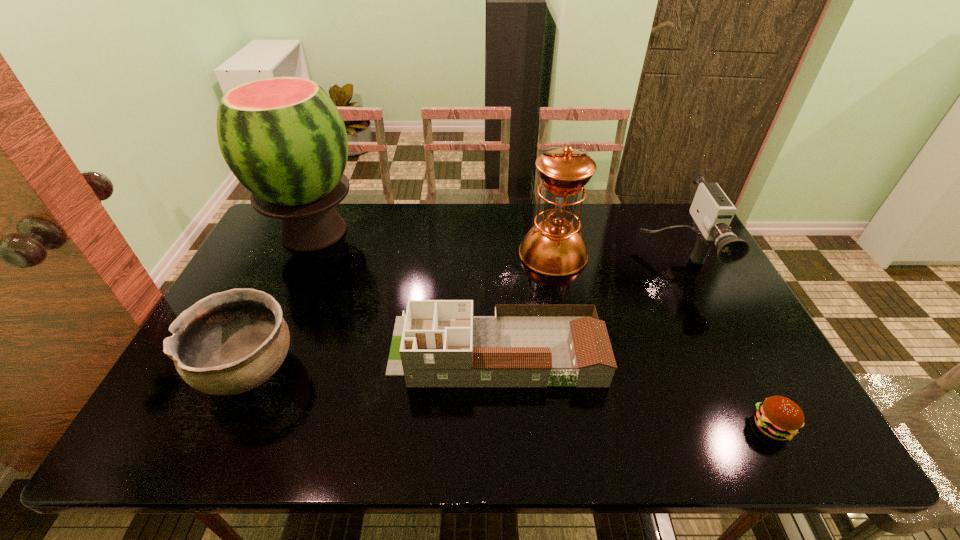
Image resolution: width=960 pixels, height=540 pixels. Identify the location of the tallest object. (283, 138).

What are the coordinates of `the second tallest object` in the screenshot? It's located at (554, 247).

What are the coordinates of `camcorder` in the screenshot? It's located at (712, 211).

Locate an element on the screen. dollhouse is located at coordinates (439, 343).

Where is `pottery`? The height and width of the screenshot is (540, 960). pottery is located at coordinates (231, 342).

Identify the location of the shortest object. (778, 417).

Where is `free space located on the right of the watermelon`? This screenshot has height=540, width=960. free space located on the right of the watermelon is located at coordinates (385, 232).

I want to click on vacant space located on the left of the fifth shortest object, so click(x=431, y=253).

Locate an element on the screen. The height and width of the screenshot is (540, 960). vacant space located on the recording direction of the third tallest object is located at coordinates (750, 411).

In order to click on blank space located 0.140m at the main entrance of the dollhouse in this screenshot , I will do `click(336, 350)`.